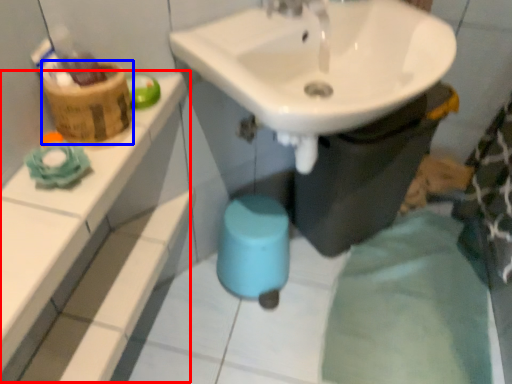
Question: Among these objects, which one is nearest to the camera, balustrade (highlighted by a red box) or basket (highlighted by a blue box)?

Choices:
 (A) balustrade
 (B) basket

Answer: (A)